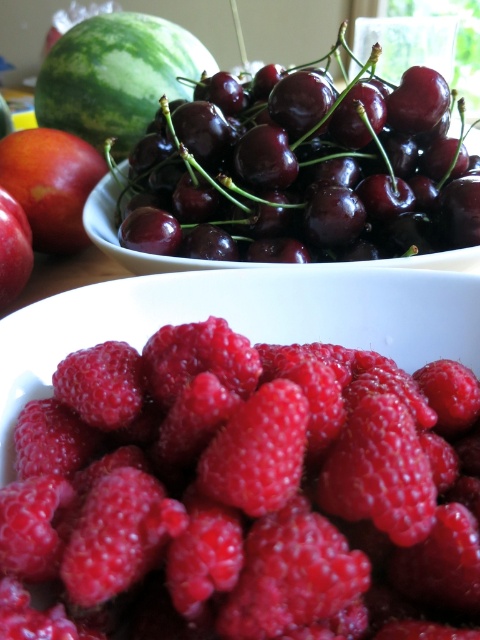
Question: Considering the real-world distances, which object is farthest from the green matte watermelon at upper left?

Choices:
 (A) matte orange peach at upper left
 (B) shiny red raspberry at center

Answer: (B)

Question: Is shiny red raspberry at center thinner than green matte watermelon at upper left?

Choices:
 (A) yes
 (B) no

Answer: (A)

Question: Estimate the real-world distances between objects in this image. Which object is closer to the matte orange peach at upper left?

Choices:
 (A) green matte watermelon at upper left
 (B) shiny red raspberry at center

Answer: (A)

Question: Which point appears closest to the camera in this image?

Choices:
 (A) (136, 460)
 (B) (3, 182)

Answer: (A)

Question: Is shiny red raspberry at center to the left of matte orange peach at upper left from the viewer's perspective?

Choices:
 (A) no
 (B) yes

Answer: (A)

Question: Can you confirm if shiny red raspberry at center is positioned above matte orange peach at upper left?

Choices:
 (A) yes
 (B) no

Answer: (B)